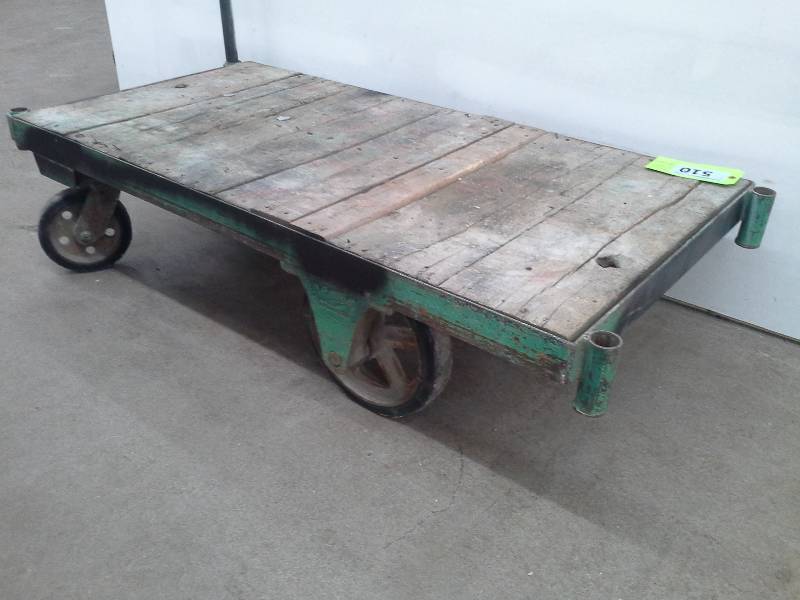
The width and height of the screenshot is (800, 600). Identify the location of trolley. (465, 194).